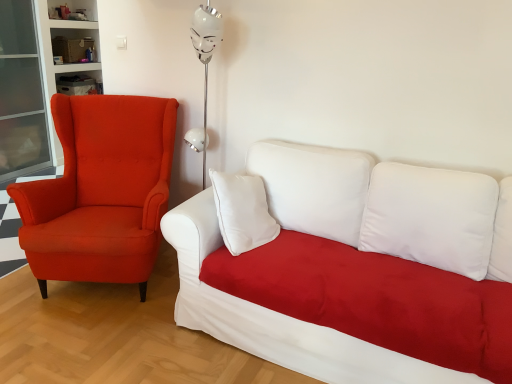
Question: From the image's perspective, is matte orange armchair at left located above or below white fabric couch at center?

Choices:
 (A) below
 (B) above

Answer: (B)

Question: Considering the positions of matte orange armchair at left and white fabric couch at center in the image, is matte orange armchair at left taller or shorter than white fabric couch at center?

Choices:
 (A) tall
 (B) short

Answer: (A)

Question: Is matte orange armchair at left inside or outside of white fabric couch at center?

Choices:
 (A) outside
 (B) inside

Answer: (A)

Question: Is white fabric couch at center inside the boundaries of matte orange armchair at left, or outside?

Choices:
 (A) outside
 (B) inside

Answer: (A)

Question: Considering the relative positions of white fabric couch at center and matte orange armchair at left in the image provided, is white fabric couch at center to the left or to the right of matte orange armchair at left?

Choices:
 (A) left
 (B) right

Answer: (B)

Question: From a real-world perspective, is white fabric couch at center physically located above or below matte orange armchair at left?

Choices:
 (A) below
 (B) above

Answer: (A)

Question: Is white fabric couch at center taller or shorter than matte orange armchair at left?

Choices:
 (A) short
 (B) tall

Answer: (A)